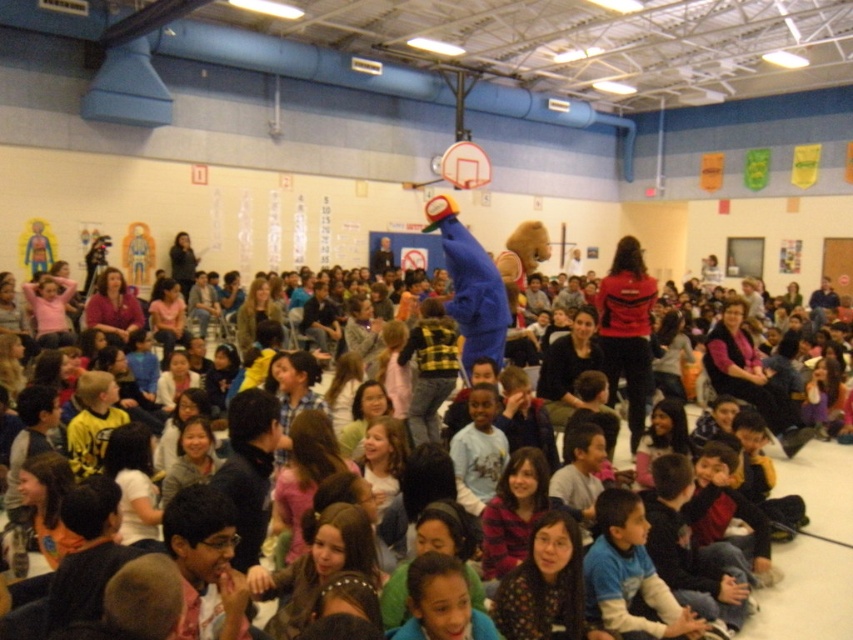
Can you confirm if matte blue mascot at center is positioned below metallic silver basketball hoop at upper center?

Yes.

Does matte blue mascot at center have a smaller size compared to metallic silver basketball hoop at upper center?

No.

Is point (814, 468) closer to viewer compared to point (454, 179)?

Yes, point (814, 468) is closer to viewer.

Find the location of a particular element. The width and height of the screenshot is (853, 640). matte blue mascot at center is located at coordinates (805, 593).